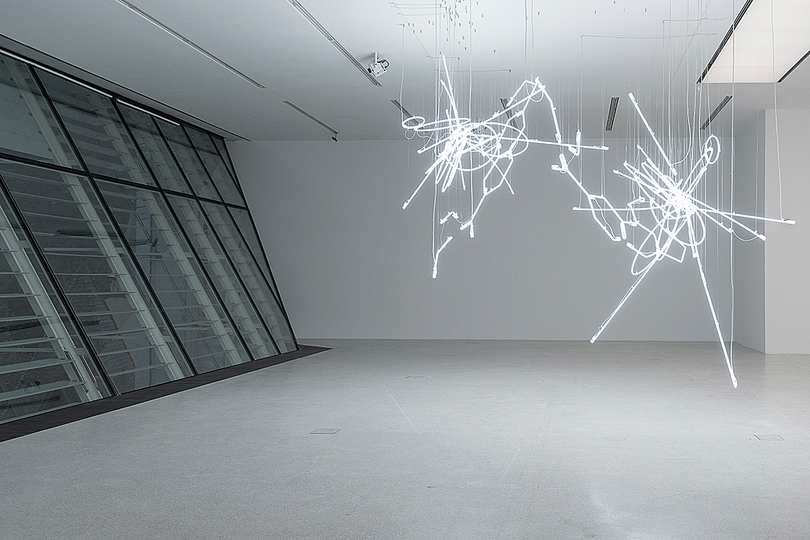
Locate an element on the screen. cables is located at coordinates (433, 79), (667, 83).